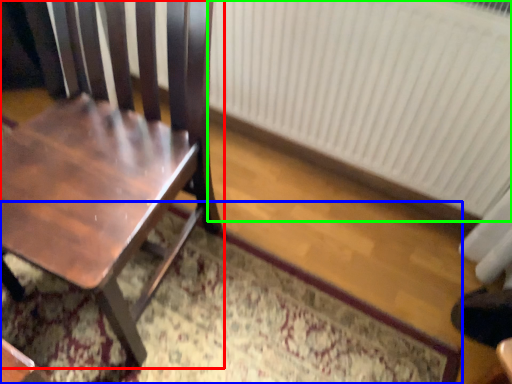
Question: Based on their relative distances, which object is farther from chair (highlighted by a red box)? Choose from doormat (highlighted by a blue box) and radiator (highlighted by a green box).

Choices:
 (A) doormat
 (B) radiator

Answer: (B)